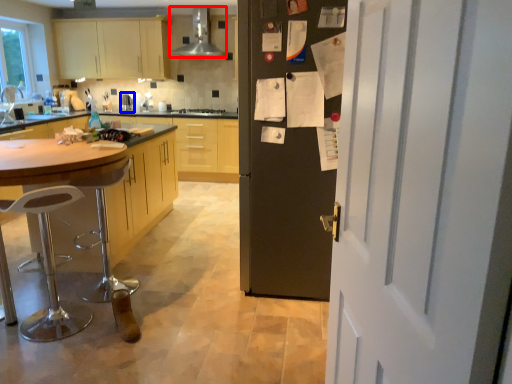
Question: Which point is further to the camera, kitchen appliance (highlighted by a red box) or appliance (highlighted by a blue box)?

Choices:
 (A) kitchen appliance
 (B) appliance

Answer: (B)